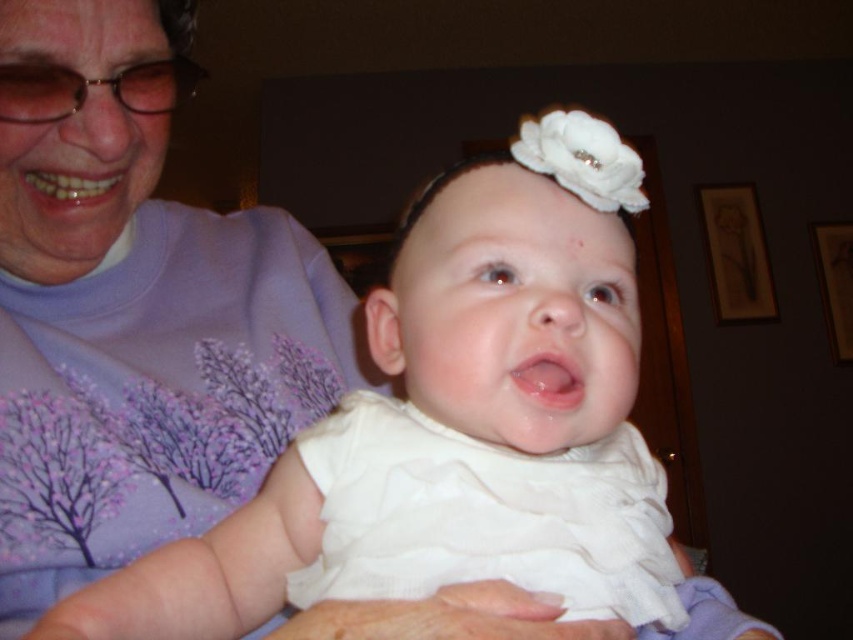
In the scene where an older woman in a purple soft fabric shirt at upper left holds a baby wearing a white satin dress at center, which object is positioned to the right of the other?

The white satin dress at center is to the right of the purple soft fabric shirt at upper left.

Based on the scene description, can you determine if the white satin dress at center is wider than the purple soft fabric shirt at upper left?

The white satin dress at center might be wider than purple soft fabric shirt at upper left according to the description.

You are a photographer trying to capture a closeup of the baby in the center. You see the point at coordinates point (456, 422). Can you tell me where exactly this point is located?

The point (456, 422) is located on the white satin dress at center. So, if you want to capture a closeup of the baby in the center, you should focus your camera on the white satin dress at center where the point is located.